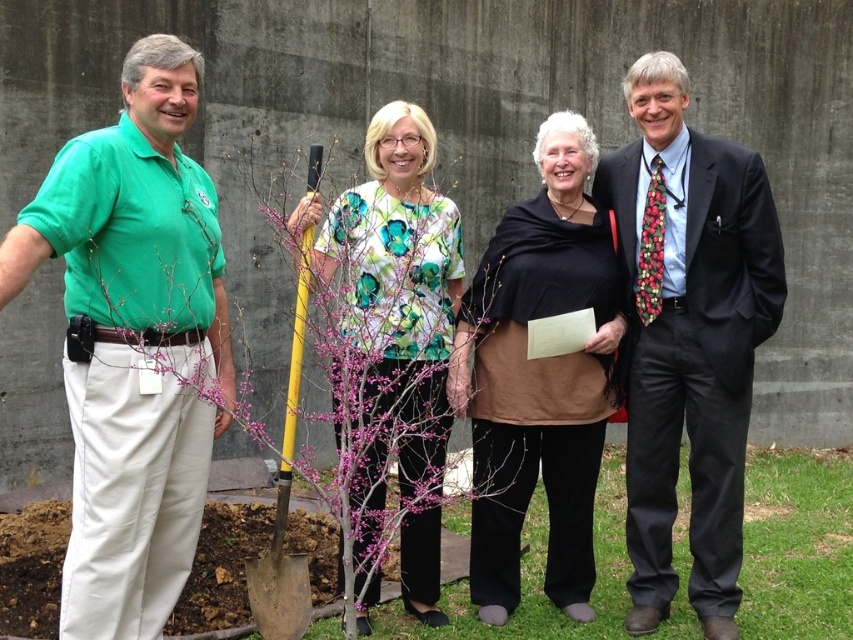
You are standing at the center of the image. Which direction should you move to get closer to the green cotton shirt at left?

Move to the left to get closer to the green cotton shirt at left since it is located at point (132, 342) which is on the left side of the image.

Which object is located at the coordinates point (132, 342)?

The point (132, 342) corresponds to the green cotton shirt at left.